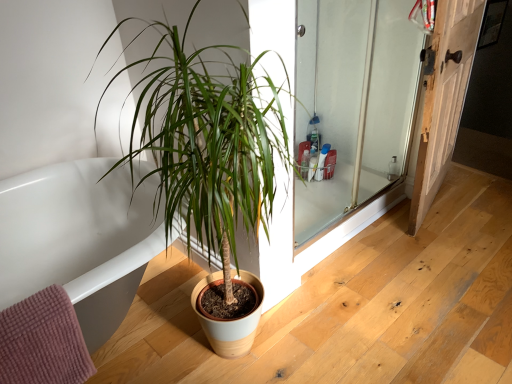
The width and height of the screenshot is (512, 384). What do you see at coordinates (444, 98) in the screenshot? I see `wooden door at right` at bounding box center [444, 98].

Locate an element on the screen. green matte plant at center is located at coordinates (209, 138).

Find the location of a particular element. Image resolution: width=512 pixels, height=384 pixels. wooden door at right is located at coordinates (444, 98).

Looking at their sizes, would you say green matte plant at center is wider or thinner than clear glass screen door at right?

Considering their sizes, green matte plant at center looks broader than clear glass screen door at right.

Can clear glass screen door at right be found inside green matte plant at center?

No, clear glass screen door at right is not surrounded by green matte plant at center.

Is green matte plant at center not close to clear glass screen door at right?

No, there isn't a large distance between green matte plant at center and clear glass screen door at right.

Which object is further away from the camera, green matte plant at center or clear glass screen door at right?

clear glass screen door at right is more distant.

From a real-world perspective, is wooden door at right below white glossy bathtub at lower left?

Actually, wooden door at right is physically above white glossy bathtub at lower left in the real world.

Is wooden door at right thinner than white glossy bathtub at lower left?

Yes.

Which of these two, wooden door at right or white glossy bathtub at lower left, is bigger?

white glossy bathtub at lower left is bigger.

Which of these two, clear glass screen door at right or wooden door at right, stands taller?

Standing taller between the two is wooden door at right.

How much distance is there between clear glass screen door at right and wooden door at right?

A distance of 14.96 inches exists between clear glass screen door at right and wooden door at right.

Between clear glass screen door at right and wooden door at right, which one has larger size?

Bigger between the two is wooden door at right.

In the scene shown: Which is behind, clear glass screen door at right or wooden door at right?

wooden door at right is behind.

Is white glossy bathtub at lower left beside clear glass screen door at right?

No, white glossy bathtub at lower left is not touching clear glass screen door at right.

Consider the image. In terms of size, does white glossy bathtub at lower left appear bigger or smaller than clear glass screen door at right?

Considering their sizes, white glossy bathtub at lower left takes up more space than clear glass screen door at right.

Based on the photo, is white glossy bathtub at lower left not inside clear glass screen door at right?

Absolutely, white glossy bathtub at lower left is external to clear glass screen door at right.

Which is more distant, (x=121, y=189) or (x=355, y=159)?

→ The point (x=355, y=159) is behind.

From a real-world perspective, which object rests below the other?

white glossy bathtub at lower left is physically lower.

From the image's perspective, is white glossy bathtub at lower left under green matte plant at center?

Yes.

Considering the sizes of objects white glossy bathtub at lower left and green matte plant at center in the image provided, who is thinner, white glossy bathtub at lower left or green matte plant at center?

Thinner between the two is green matte plant at center.

Considering their positions, is white glossy bathtub at lower left located in front of or behind green matte plant at center?

Visually, white glossy bathtub at lower left is located behind green matte plant at center.

Between green matte plant at center and white glossy bathtub at lower left, which one is positioned in front?

Positioned in front is green matte plant at center.

From the image's perspective, would you say green matte plant at center is shown under white glossy bathtub at lower left?

No.

Which object is positioned more to the right, green matte plant at center or white glossy bathtub at lower left?

green matte plant at center.

Does green matte plant at center touch white glossy bathtub at lower left?

No, green matte plant at center is not beside white glossy bathtub at lower left.

Does white glossy bathtub at lower left have a smaller size compared to wooden door at right?

Incorrect, white glossy bathtub at lower left is not smaller in size than wooden door at right.

Is white glossy bathtub at lower left to the left or to the right of wooden door at right in the image?

white glossy bathtub at lower left is to the left of wooden door at right.

What are the coordinates of `door above the white glossy bathtub at lower left (from a real-world perspective)` in the screenshot? It's located at (444, 98).

Based on the photo, from their relative heights in the image, would you say white glossy bathtub at lower left is taller or shorter than wooden door at right?

Clearly, white glossy bathtub at lower left is shorter compared to wooden door at right.

This screenshot has width=512, height=384. I want to click on houseplant below the clear glass screen door at right (from a real-world perspective), so click(209, 138).

At what (x,y) coordinates should I click in order to perform the action: click on bathtub in front of the wooden door at right. Please return your answer as a coordinate pair (x, y). Looking at the image, I should click on (78, 240).

Considering their positions, is clear glass screen door at right positioned closer to white glossy bathtub at lower left than green matte plant at center?

green matte plant at center.

When comparing their distances from clear glass screen door at right, does white glossy bathtub at lower left or wooden door at right seem further?

white glossy bathtub at lower left is further to clear glass screen door at right.

When comparing their distances from green matte plant at center, does white glossy bathtub at lower left or wooden door at right seem further?

wooden door at right lies further to green matte plant at center than the other object.

Estimate the real-world distances between objects in this image. Which object is further from clear glass screen door at right, wooden door at right or green matte plant at center?

Based on the image, green matte plant at center appears to be further to clear glass screen door at right.

Based on their spatial positions, is white glossy bathtub at lower left or clear glass screen door at right further from wooden door at right?

white glossy bathtub at lower left lies further to wooden door at right than the other object.

Looking at the image, which one is located closer to green matte plant at center, white glossy bathtub at lower left or clear glass screen door at right?

Based on the image, white glossy bathtub at lower left appears to be nearer to green matte plant at center.

Looking at the image, which one is located further to wooden door at right, clear glass screen door at right or white glossy bathtub at lower left?

white glossy bathtub at lower left.

Based on their spatial positions, is green matte plant at center or wooden door at right closer to white glossy bathtub at lower left?

Based on the image, green matte plant at center appears to be nearer to white glossy bathtub at lower left.

Image resolution: width=512 pixels, height=384 pixels. Identify the location of houseplant between white glossy bathtub at lower left and wooden door at right from left to right. (209, 138).

Find the location of `screen door situated between white glossy bathtub at lower left and wooden door at right from left to right`. screen door situated between white glossy bathtub at lower left and wooden door at right from left to right is located at coordinates (354, 106).

Locate an element on the screen. The height and width of the screenshot is (384, 512). houseplant between white glossy bathtub at lower left and clear glass screen door at right from left to right is located at coordinates click(x=209, y=138).

Where is `screen door between green matte plant at center and wooden door at right from left to right`? The width and height of the screenshot is (512, 384). screen door between green matte plant at center and wooden door at right from left to right is located at coordinates (354, 106).